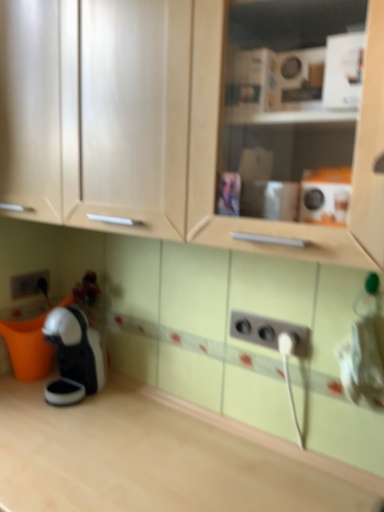
Question: Which direction should I rotate to look at white plastic outlet at lower center, which is the second electric outlet in top-to-bottom order, — up or down?

Choices:
 (A) down
 (B) up

Answer: (A)

Question: Is black plastic coffee machine at lower left to the left of white plastic outlet at lower center, placed as the first electric outlet when sorted from right to left, from the viewer's perspective?

Choices:
 (A) no
 (B) yes

Answer: (B)

Question: Does black plastic coffee machine at lower left lie behind white plastic outlet at lower center, acting as the first electric outlet starting from the bottom?

Choices:
 (A) yes
 (B) no

Answer: (A)

Question: Are black plastic coffee machine at lower left and white plastic outlet at lower center, the second electric outlet viewed from the left, making contact?

Choices:
 (A) no
 (B) yes

Answer: (A)

Question: Can you confirm if black plastic coffee machine at lower left is smaller than white plastic outlet at lower center, which is the second electric outlet in top-to-bottom order?

Choices:
 (A) no
 (B) yes

Answer: (A)

Question: From the image's perspective, is black plastic coffee machine at lower left below white plastic outlet at lower center, which is the second electric outlet in top-to-bottom order?

Choices:
 (A) yes
 (B) no

Answer: (A)

Question: From a real-world perspective, is black plastic coffee machine at lower left located higher than white plastic outlet at lower center, the second electric outlet viewed from the left?

Choices:
 (A) no
 (B) yes

Answer: (A)

Question: Considering the relative sizes of light wood countertop at lower left and matte wood cabinet at upper center in the image provided, is light wood countertop at lower left wider than matte wood cabinet at upper center?

Choices:
 (A) yes
 (B) no

Answer: (A)

Question: Is light wood countertop at lower left oriented towards matte wood cabinet at upper center?

Choices:
 (A) yes
 (B) no

Answer: (B)

Question: From a real-world perspective, does light wood countertop at lower left sit lower than matte wood cabinet at upper center?

Choices:
 (A) yes
 (B) no

Answer: (A)

Question: Does light wood countertop at lower left have a lesser height compared to matte wood cabinet at upper center?

Choices:
 (A) no
 (B) yes

Answer: (B)

Question: Is light wood countertop at lower left in front of matte wood cabinet at upper center?

Choices:
 (A) yes
 (B) no

Answer: (B)

Question: From the image's perspective, is light wood countertop at lower left located beneath matte wood cabinet at upper center?

Choices:
 (A) yes
 (B) no

Answer: (A)

Question: From the image's perspective, is light wood countertop at lower left under matte gray electric outlet at lower left, which ranks as the 1th electric outlet in top-to-bottom order?

Choices:
 (A) yes
 (B) no

Answer: (A)